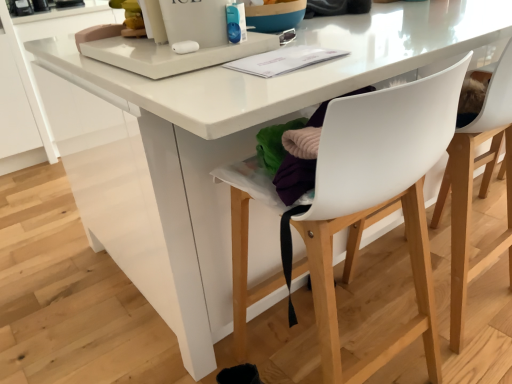
Describe the element at coordinates (480, 188) in the screenshot. The height and width of the screenshot is (384, 512). I see `white plastic chair at center, the first chair from the right` at that location.

Find the location of a particular element. The image size is (512, 384). white plastic chair at center, acting as the 2th chair starting from the left is located at coordinates (480, 188).

The image size is (512, 384). Describe the element at coordinates (378, 202) in the screenshot. I see `white plastic chair at center, arranged as the first chair when viewed from the left` at that location.

At what (x,y) coordinates should I click in order to perform the action: click on white plastic chair at center, the second chair from the right. Please return your answer as a coordinate pair (x, y). Looking at the image, I should click on (378, 202).

What is the approximate height of white plastic chair at center, the second chair from the right?

The height of white plastic chair at center, the second chair from the right, is 90.96 centimeters.

This screenshot has width=512, height=384. Find the location of `white plastic chair at center, the first chair from the right`. white plastic chair at center, the first chair from the right is located at coordinates (480, 188).

Can you confirm if white plastic chair at center, arranged as the first chair when viewed from the left, is positioned to the left of white plastic chair at center, acting as the 2th chair starting from the left?

Correct, you'll find white plastic chair at center, arranged as the first chair when viewed from the left, to the left of white plastic chair at center, acting as the 2th chair starting from the left.

Which object is further away from the camera taking this photo, white plastic chair at center, arranged as the first chair when viewed from the left, or white plastic chair at center, the first chair from the right?

white plastic chair at center, the first chair from the right, is further away from the camera.

Is point (404, 135) closer or farther from the camera than point (462, 333)?

Point (404, 135) is closer to the camera than point (462, 333).

From the image's perspective, is white plastic chair at center, arranged as the first chair when viewed from the left, on white plastic chair at center, acting as the 2th chair starting from the left?

No, from the image's perspective, white plastic chair at center, arranged as the first chair when viewed from the left, is not above white plastic chair at center, acting as the 2th chair starting from the left.

From a real-world perspective, which object stands above the other?

white plastic chair at center, arranged as the first chair when viewed from the left, is physically above.

Consider the image. Which of these two, white plastic chair at center, the second chair from the right, or white plastic chair at center, the first chair from the right, is thinner?

With smaller width is white plastic chair at center, the first chair from the right.

Does white plastic chair at center, arranged as the first chair when viewed from the left, have a greater height compared to white plastic chair at center, the first chair from the right?

Incorrect, the height of white plastic chair at center, arranged as the first chair when viewed from the left, is not larger of that of white plastic chair at center, the first chair from the right.

Which of these two, white plastic chair at center, arranged as the first chair when viewed from the left, or white plastic chair at center, acting as the 2th chair starting from the left, is bigger?

Bigger between the two is white plastic chair at center, arranged as the first chair when viewed from the left.

Which is correct: white plastic chair at center, the second chair from the right, is inside white plastic chair at center, acting as the 2th chair starting from the left, or outside of it?

white plastic chair at center, the second chair from the right, cannot be found inside white plastic chair at center, acting as the 2th chair starting from the left.

Is white plastic chair at center, arranged as the first chair when viewed from the left, not near white plastic chair at center, acting as the 2th chair starting from the left?

No, white plastic chair at center, arranged as the first chair when viewed from the left, is not far away from white plastic chair at center, acting as the 2th chair starting from the left.

Is white plastic chair at center, the second chair from the right, oriented towards white plastic chair at center, acting as the 2th chair starting from the left?

No, white plastic chair at center, the second chair from the right, is not oriented towards white plastic chair at center, acting as the 2th chair starting from the left.

The width and height of the screenshot is (512, 384). What are the coordinates of `chair located on the left of white plastic chair at center, acting as the 2th chair starting from the left` in the screenshot? It's located at (378, 202).

Which object is positioned more to the right, white plastic chair at center, acting as the 2th chair starting from the left, or white plastic chair at center, arranged as the first chair when viewed from the left?

Positioned to the right is white plastic chair at center, acting as the 2th chair starting from the left.

Between white plastic chair at center, the first chair from the right, and white plastic chair at center, the second chair from the right, which one is positioned in front?

Positioned in front is white plastic chair at center, the second chair from the right.

Which is in front, point (499, 88) or point (431, 81)?

Positioned in front is point (431, 81).

From the image's perspective, which one is positioned higher, white plastic chair at center, the first chair from the right, or white plastic chair at center, arranged as the first chair when viewed from the left?

white plastic chair at center, the first chair from the right, is shown above in the image.

From a real-world perspective, is white plastic chair at center, acting as the 2th chair starting from the left, positioned above or below white plastic chair at center, arranged as the first chair when viewed from the left?

white plastic chair at center, acting as the 2th chair starting from the left, is situated lower than white plastic chair at center, arranged as the first chair when viewed from the left, in the real world.

In terms of width, does white plastic chair at center, the first chair from the right, look wider or thinner when compared to white plastic chair at center, arranged as the first chair when viewed from the left?

Clearly, white plastic chair at center, the first chair from the right, has less width compared to white plastic chair at center, arranged as the first chair when viewed from the left.

Does white plastic chair at center, acting as the 2th chair starting from the left, have a greater height compared to white plastic chair at center, the second chair from the right?

Indeed, white plastic chair at center, acting as the 2th chair starting from the left, has a greater height compared to white plastic chair at center, the second chair from the right.

Based on the photo, considering the sizes of objects white plastic chair at center, the first chair from the right, and white plastic chair at center, the second chair from the right, in the image provided, who is bigger, white plastic chair at center, the first chair from the right, or white plastic chair at center, the second chair from the right,?

Bigger between the two is white plastic chair at center, the second chair from the right.

Is white plastic chair at center, the first chair from the right, inside the boundaries of white plastic chair at center, arranged as the first chair when viewed from the left, or outside?

white plastic chair at center, the first chair from the right, is located beyond the bounds of white plastic chair at center, arranged as the first chair when viewed from the left.

Is white plastic chair at center, acting as the 2th chair starting from the left, in contact with white plastic chair at center, the second chair from the right?

No, white plastic chair at center, acting as the 2th chair starting from the left, is not in contact with white plastic chair at center, the second chair from the right.

From the picture: Is white plastic chair at center, the first chair from the right, facing away from white plastic chair at center, arranged as the first chair when viewed from the left?

No, white plastic chair at center, the first chair from the right, is not facing the opposite direction of white plastic chair at center, arranged as the first chair when viewed from the left.

The height and width of the screenshot is (384, 512). I want to click on chair on the right of the white plastic chair at center, the second chair from the right, so click(x=480, y=188).

The width and height of the screenshot is (512, 384). Identify the location of chair on the left of white plastic chair at center, the first chair from the right. (378, 202).

What are the coordinates of `chair below the white plastic chair at center, the first chair from the right (from the image's perspective)` in the screenshot? It's located at (378, 202).